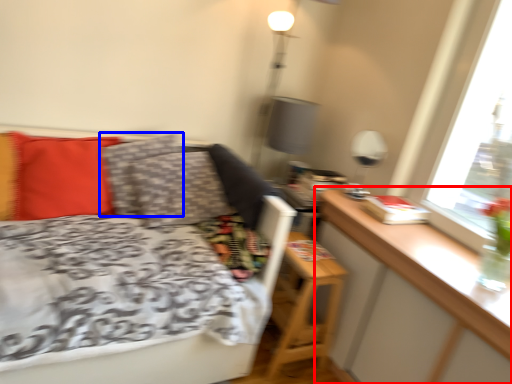
Question: Which object is further to the camera taking this photo, table (highlighted by a red box) or pillow (highlighted by a blue box)?

Choices:
 (A) table
 (B) pillow

Answer: (B)